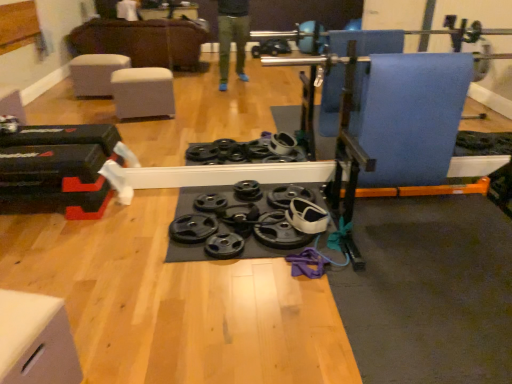
Question: Would you say black rubber weight plate at center, the third wheel from the right, is outside white matte drawer at lower left?

Choices:
 (A) no
 (B) yes

Answer: (B)

Question: Does black rubber weight plate at center, the first wheel viewed from the left, touch white matte drawer at lower left?

Choices:
 (A) yes
 (B) no

Answer: (B)

Question: Is black rubber weight plate at center, the third wheel from the right, taller than white matte drawer at lower left?

Choices:
 (A) yes
 (B) no

Answer: (B)

Question: Can you confirm if black rubber weight plate at center, the first wheel viewed from the left, is thinner than white matte drawer at lower left?

Choices:
 (A) no
 (B) yes

Answer: (B)

Question: From a real-world perspective, is black rubber weight plate at center, the third wheel from the right, on white matte drawer at lower left?

Choices:
 (A) yes
 (B) no

Answer: (B)

Question: From the image's perspective, is white matte drawer at lower left above or below black rubber weight plate at center, placed as the second wheel when sorted from right to left?

Choices:
 (A) above
 (B) below

Answer: (B)

Question: Based on their sizes in the image, would you say white matte drawer at lower left is bigger or smaller than black rubber weight plate at center, placed as the 2th wheel when sorted from left to right?

Choices:
 (A) small
 (B) big

Answer: (B)

Question: From their relative heights in the image, would you say white matte drawer at lower left is taller or shorter than black rubber weight plate at center, placed as the 2th wheel when sorted from left to right?

Choices:
 (A) tall
 (B) short

Answer: (A)

Question: Considering the positions of white matte drawer at lower left and black rubber weight plate at center, placed as the second wheel when sorted from right to left, in the image, is white matte drawer at lower left wider or thinner than black rubber weight plate at center, placed as the second wheel when sorted from right to left,?

Choices:
 (A) thin
 (B) wide

Answer: (B)

Question: Looking at their shapes, would you say black rubber weight plate at center, the 1th wheel from the right, is wider or thinner than black rubber weight plate at center, placed as the second wheel when sorted from right to left?

Choices:
 (A) thin
 (B) wide

Answer: (B)

Question: Is point (269, 211) positioned closer to the camera than point (239, 238)?

Choices:
 (A) farther
 (B) closer

Answer: (A)

Question: Considering the relative positions of black rubber weight plate at center, the 1th wheel from the right, and black rubber weight plate at center, placed as the 2th wheel when sorted from left to right, in the image provided, is black rubber weight plate at center, the 1th wheel from the right, to the left or to the right of black rubber weight plate at center, placed as the 2th wheel when sorted from left to right,?

Choices:
 (A) right
 (B) left

Answer: (A)

Question: From the image's perspective, relative to black rubber weight plate at center, placed as the second wheel when sorted from right to left, is black rubber weight plate at center, positioned as the third wheel in left-to-right order, above or below?

Choices:
 (A) below
 (B) above

Answer: (B)

Question: Is black rubber weight plate at center, the first wheel viewed from the left, to the left or to the right of black rubber weight plate at center, the 1th wheel from the right, in the image?

Choices:
 (A) right
 (B) left

Answer: (B)

Question: Is black rubber weight plate at center, the first wheel viewed from the left, inside the boundaries of black rubber weight plate at center, the 1th wheel from the right, or outside?

Choices:
 (A) inside
 (B) outside

Answer: (B)